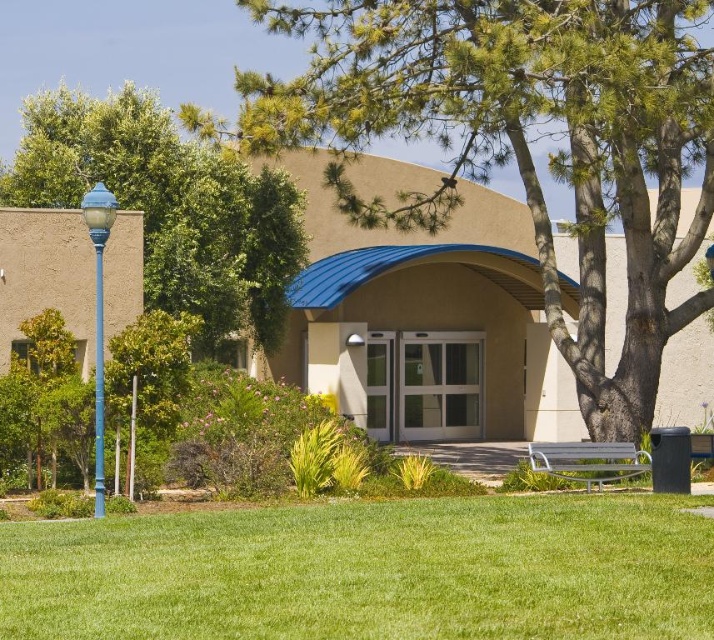
Question: Observing the image, what is the correct spatial positioning of green leafy tree at center in reference to green grass at lower center?

Choices:
 (A) left
 (B) right

Answer: (B)

Question: Does green grass at lower center have a lesser width compared to green leafy tree at left?

Choices:
 (A) yes
 (B) no

Answer: (A)

Question: Which of the following is the closest to the observer?

Choices:
 (A) blue metallic lamp post at left
 (B) green grass at lower center
 (C) metallic silver bench at lower right
 (D) green leafy tree at left

Answer: (B)

Question: In this image, where is green leafy tree at left located relative to blue metallic lamp post at left?

Choices:
 (A) left
 (B) right

Answer: (A)

Question: Which point is farther to the camera?

Choices:
 (A) pos(348,528)
 (B) pos(608,83)

Answer: (B)

Question: Considering the real-world distances, which object is farthest from the blue metallic lamp post at left?

Choices:
 (A) green grass at lower center
 (B) metallic silver bench at lower right

Answer: (B)